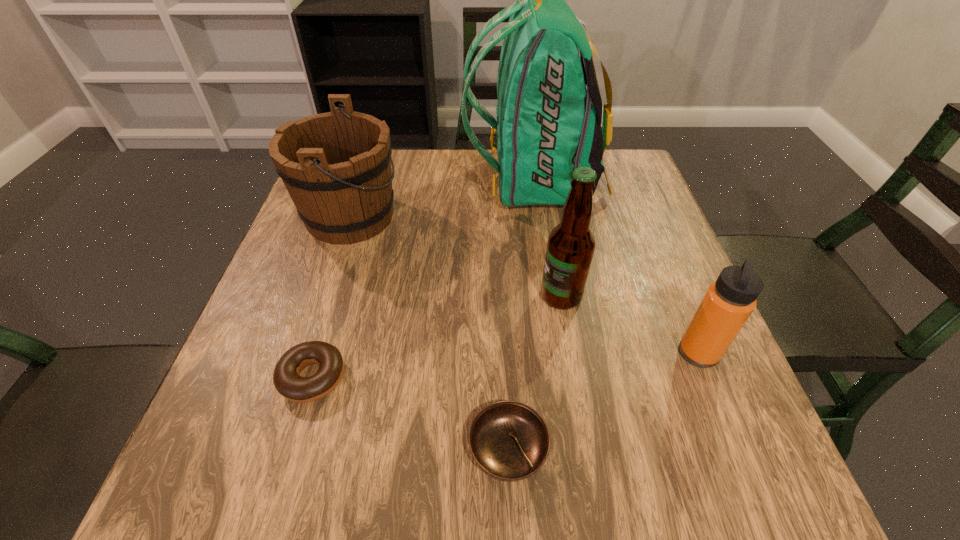
Locate an element on the screen. The image size is (960, 540). backpack is located at coordinates (548, 124).

The height and width of the screenshot is (540, 960). What are the coordinates of `the third farthest object` in the screenshot? It's located at (571, 244).

At what (x,y) coordinates should I click in order to perform the action: click on beer bottle. Please return your answer as a coordinate pair (x, y). The width and height of the screenshot is (960, 540). Looking at the image, I should click on (571, 244).

What are the coordinates of `wine bucket` in the screenshot? It's located at [x=336, y=166].

Where is `the rightmost object`? This screenshot has height=540, width=960. the rightmost object is located at coordinates (729, 301).

Image resolution: width=960 pixels, height=540 pixels. I want to click on doughnut, so click(286, 377).

Identify the location of soup bowl. The width and height of the screenshot is (960, 540). (509, 440).

Image resolution: width=960 pixels, height=540 pixels. Find the location of `free region located on the back of the backpack`. free region located on the back of the backpack is located at coordinates (397, 183).

The width and height of the screenshot is (960, 540). Identify the location of free region located on the back of the backpack. (353, 183).

Locate an element on the screen. Image resolution: width=960 pixels, height=540 pixels. free space located on the back of the backpack is located at coordinates (364, 183).